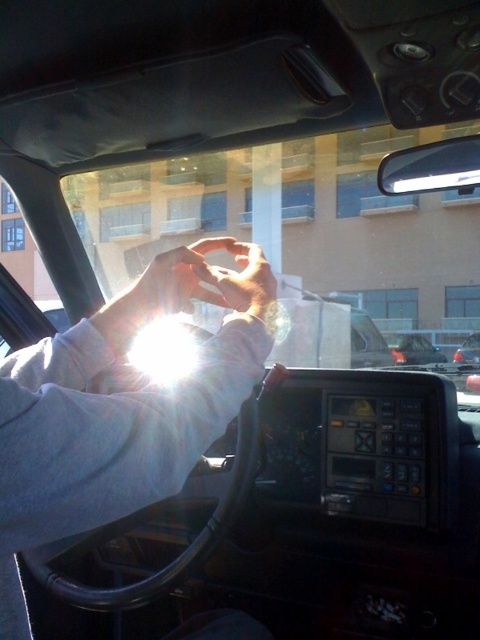
Who is shorter, white matte hands at center or translucent skin at center?

translucent skin at center

How far apart are white matte hands at center and translucent skin at center?

white matte hands at center and translucent skin at center are 7.37 inches apart.

Is point (11, 620) positioned before point (166, 292)?

Yes, it is.

At what (x,y) coordinates should I click in order to perform the action: click on white matte hands at center. Please return your answer as a coordinate pair (x, y). Looking at the image, I should click on (120, 408).

Can you confirm if translucent skin at center is taller than matte skin hand at center?

Yes.

Is translucent skin at center in front of matte skin hand at center?

No, it is not.

Between point (109, 316) and point (220, 294), which one is positioned in front?

Point (220, 294) is more forward.

Identify the location of translucent skin at center. The image size is (480, 640). (157, 292).

Does point (1, 378) come closer to viewer compared to point (252, 300)?

Yes, point (1, 378) is closer to viewer.

Which is more to the right, white matte hands at center or matte skin hand at center?

Positioned to the right is matte skin hand at center.

This screenshot has width=480, height=640. What are the coordinates of `white matte hands at center` in the screenshot? It's located at 120,408.